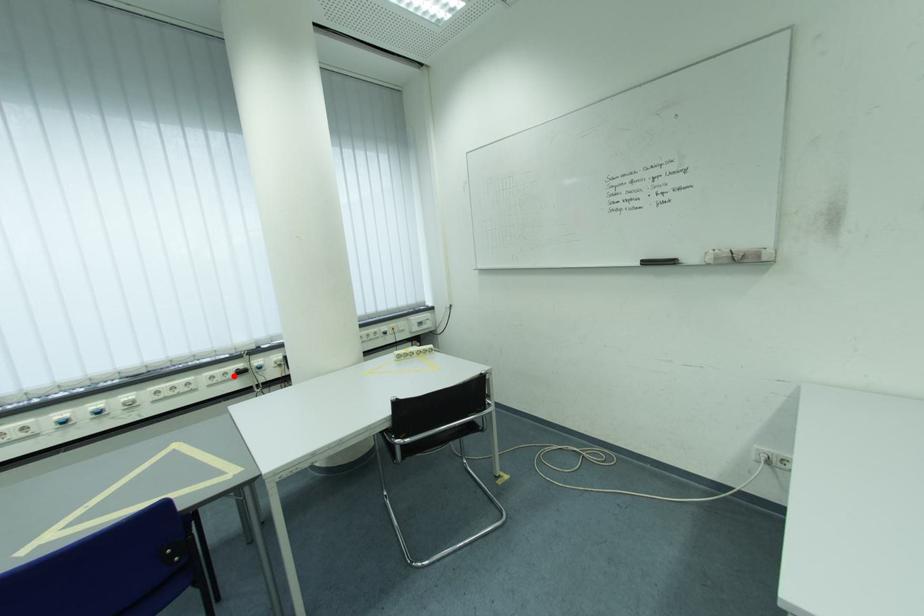
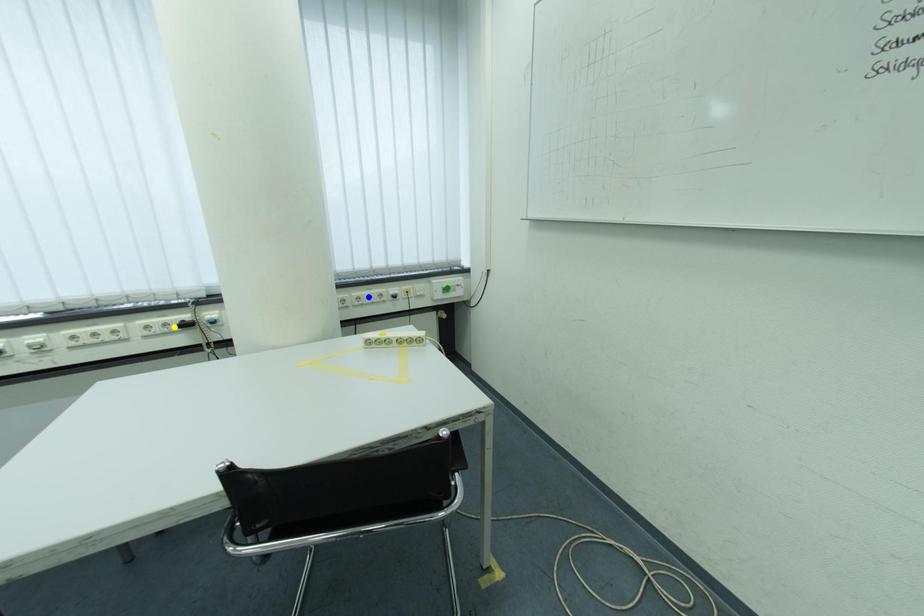
Question: I am providing you with two images of the same scene from different viewpoints. A red point is marked on the first image. You are given multiple points on the second image. Which point in image 2 is actually the same real-world point as the red point in image 1?

Choices:
 (A) green point
 (B) yellow point
 (C) blue point

Answer: (B)